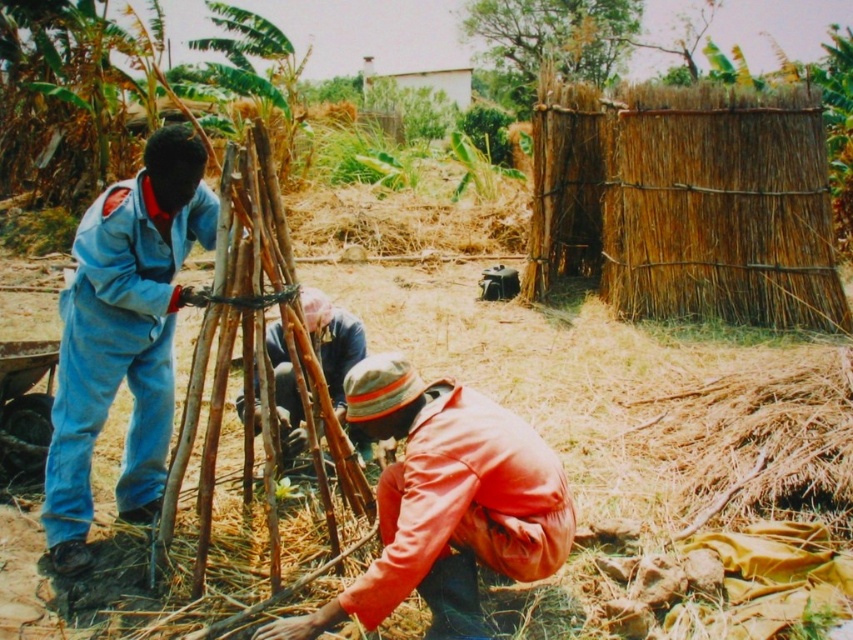
Which is below, blue denim jumpsuit at left or orange fabric at lower center?

orange fabric at lower center

Who is higher up, blue denim jumpsuit at left or orange fabric at lower center?

Positioned higher is blue denim jumpsuit at left.

What are the coordinates of `blue denim jumpsuit at left` in the screenshot? It's located at (125, 337).

Which is more to the right, orange fabric at lower center or brown fabric at center?

orange fabric at lower center is more to the right.

Who is shorter, orange fabric at lower center or brown fabric at center?

Standing shorter between the two is brown fabric at center.

Does point (352, 596) lie in front of point (335, 380)?

Yes, it is in front of point (335, 380).

The height and width of the screenshot is (640, 853). Identify the location of orange fabric at lower center. (445, 492).

Image resolution: width=853 pixels, height=640 pixels. Find the location of `blue denim jumpsuit at left`. blue denim jumpsuit at left is located at coordinates (125, 337).

Does blue denim jumpsuit at left appear on the right side of brown fabric at center?

No, blue denim jumpsuit at left is not to the right of brown fabric at center.

What are the coordinates of `blue denim jumpsuit at left` in the screenshot? It's located at (125, 337).